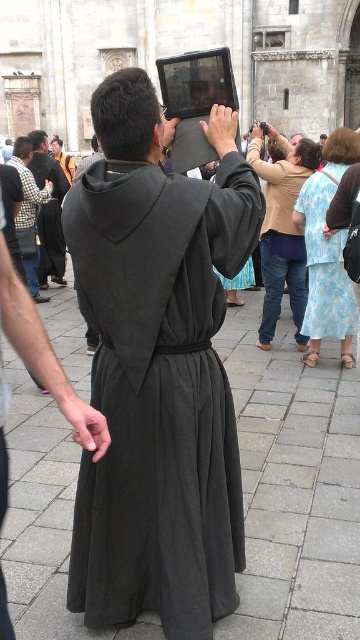
Question: Estimate the real-world distances between objects in this image. Which object is farther from the light brown fabric dress at center?

Choices:
 (A) matte black robe at center
 (B) dark gray robe at center

Answer: (A)

Question: Which of the following is the farthest from the observer?

Choices:
 (A) (294, 240)
 (B) (16, 172)

Answer: (B)

Question: Can you confirm if matte black robe at center is positioned to the left of dark gray robe at center?

Choices:
 (A) no
 (B) yes

Answer: (A)

Question: Can you confirm if floral fabric dress at lower right is bigger than dark gray robe at center?

Choices:
 (A) yes
 (B) no

Answer: (B)

Question: Is floral fabric dress at lower right positioned at the back of checkered fabric shirt at center?

Choices:
 (A) yes
 (B) no

Answer: (B)

Question: Which is farther from the light brown fabric dress at center?

Choices:
 (A) floral fabric dress at lower right
 (B) light brown fabric blouse at upper center
 (C) matte black robe at center

Answer: (C)